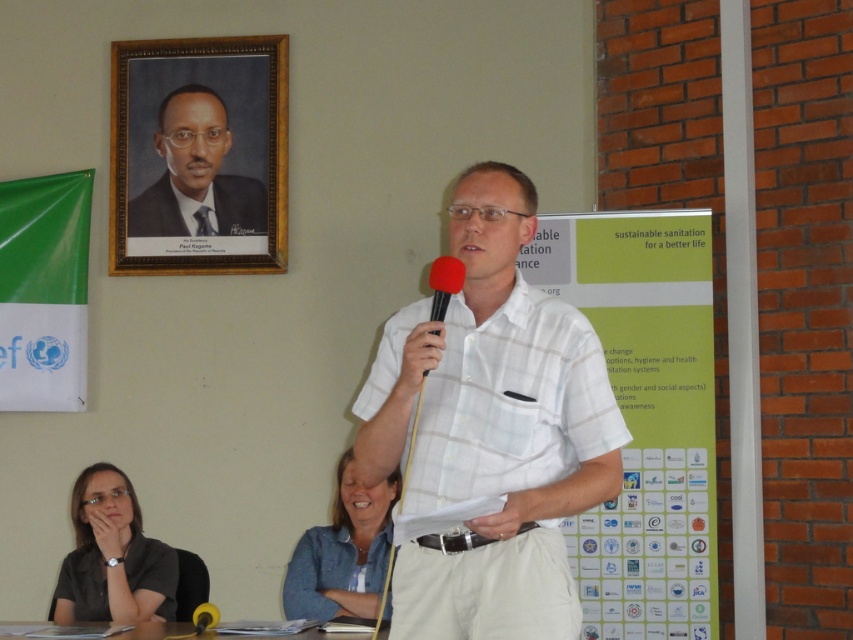
Question: Can you confirm if formal black suit at upper left is positioned to the right of blue denim shirt at lower center?

Choices:
 (A) yes
 (B) no

Answer: (B)

Question: Which point is farther to the camera?

Choices:
 (A) white checkered shirt at center
 (B) formal black suit at upper left

Answer: (B)

Question: Which of the following is the closest to the observer?

Choices:
 (A) (526, 588)
 (B) (350, 483)

Answer: (A)

Question: In this image, where is white checkered shirt at center located relative to wooden picture frame at upper left?

Choices:
 (A) left
 (B) right

Answer: (B)

Question: Which object is farther from the camera taking this photo?

Choices:
 (A) blue denim shirt at lower center
 (B) white checkered shirt at center

Answer: (A)

Question: Is wooden picture frame at upper left below matte red microphone at center?

Choices:
 (A) no
 (B) yes

Answer: (A)